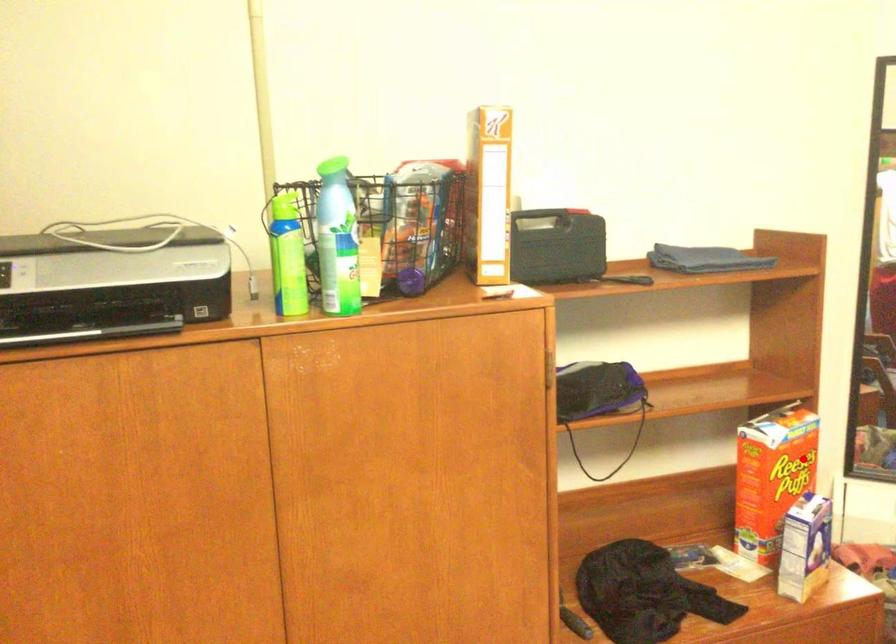
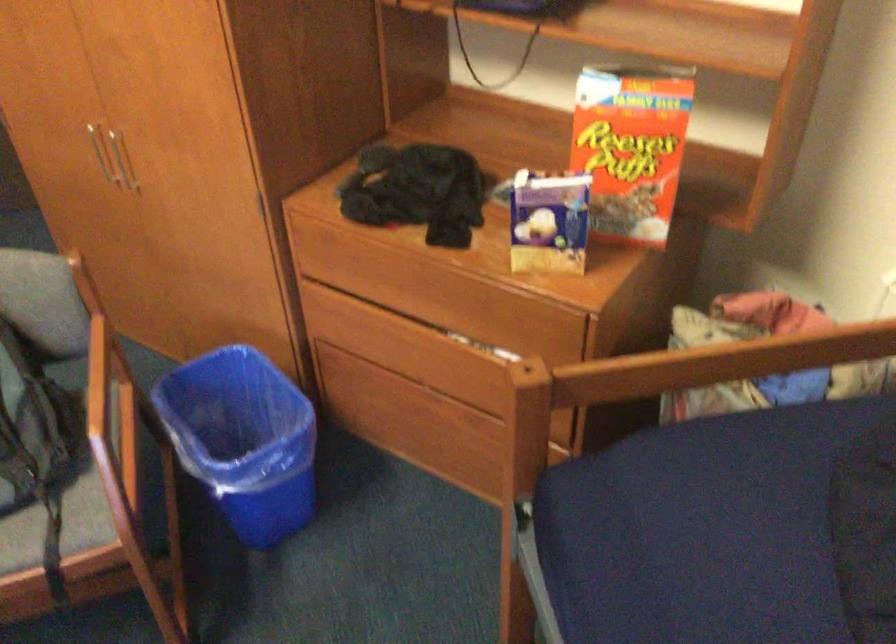
Question: A red point is marked in image1. In image2, is the corresponding 3D point closer to the camera or farther? Reply with the corresponding letter.

Choices:
 (A) The corresponding 3D point is closer.
 (B) The corresponding 3D point is farther.

Answer: (A)